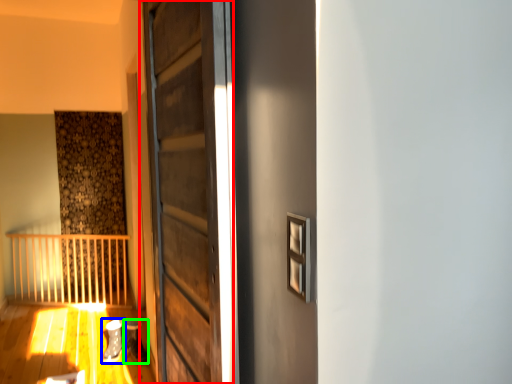
Question: Which object is positioned farthest from door (highlighted by a red box)? Select from shoe (highlighted by a blue box) and shoe (highlighted by a green box).

Choices:
 (A) shoe
 (B) shoe

Answer: (B)